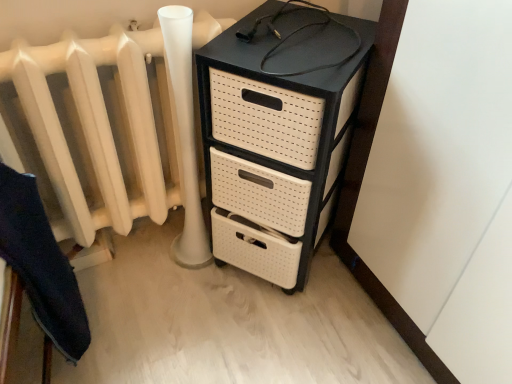
Question: Is black plastic chest of drawers at upper right positioned behind dark blue fabric at lower left?

Choices:
 (A) yes
 (B) no

Answer: (A)

Question: Does black plastic chest of drawers at upper right have a greater width compared to dark blue fabric at lower left?

Choices:
 (A) no
 (B) yes

Answer: (B)

Question: From a real-world perspective, is black plastic chest of drawers at upper right under dark blue fabric at lower left?

Choices:
 (A) yes
 (B) no

Answer: (B)

Question: From a real-world perspective, does black plastic chest of drawers at upper right stand above dark blue fabric at lower left?

Choices:
 (A) yes
 (B) no

Answer: (A)

Question: Does black plastic chest of drawers at upper right have a larger size compared to dark blue fabric at lower left?

Choices:
 (A) yes
 (B) no

Answer: (A)

Question: Does black plastic chest of drawers at upper right have a lesser width compared to dark blue fabric at lower left?

Choices:
 (A) yes
 (B) no

Answer: (B)

Question: Is dark blue fabric at lower left oriented towards white matte radiator at left?

Choices:
 (A) yes
 (B) no

Answer: (B)

Question: Is white matte radiator at left located within dark blue fabric at lower left?

Choices:
 (A) no
 (B) yes

Answer: (A)

Question: From the image's perspective, would you say dark blue fabric at lower left is shown under white matte radiator at left?

Choices:
 (A) yes
 (B) no

Answer: (A)

Question: Is dark blue fabric at lower left to the left of white matte radiator at left from the viewer's perspective?

Choices:
 (A) yes
 (B) no

Answer: (A)

Question: Considering the relative sizes of dark blue fabric at lower left and white matte radiator at left in the image provided, is dark blue fabric at lower left taller than white matte radiator at left?

Choices:
 (A) no
 (B) yes

Answer: (B)

Question: From a real-world perspective, is dark blue fabric at lower left positioned under white matte radiator at left based on gravity?

Choices:
 (A) no
 (B) yes

Answer: (B)

Question: Is black plastic chest of drawers at upper right inside white matte radiator at left?

Choices:
 (A) yes
 (B) no

Answer: (B)